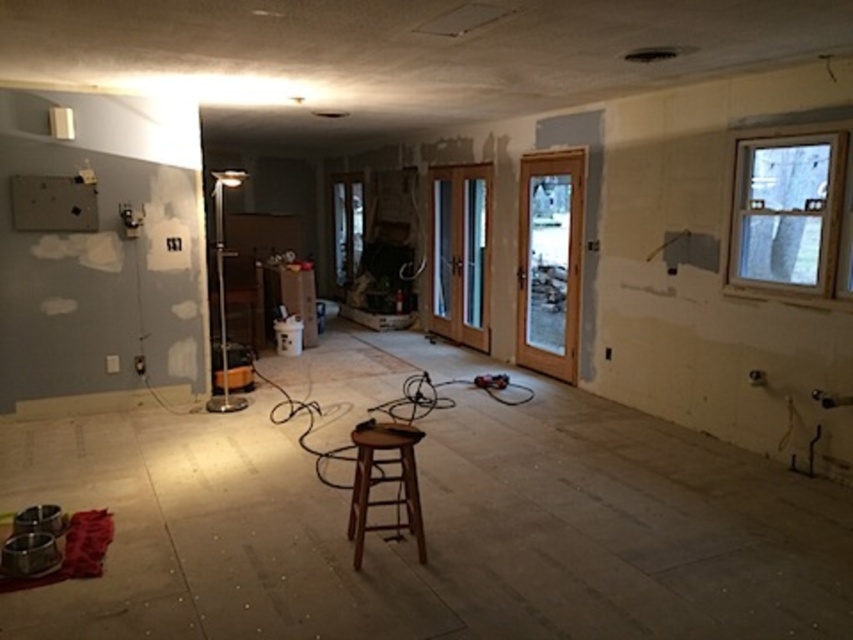
Does point (804, 140) lie behind point (378, 424)?

Yes.

Does clear glass window at upper right have a smaller size compared to brown wooden stool at center?

Yes, clear glass window at upper right is smaller than brown wooden stool at center.

Which is behind, point (808, 192) or point (370, 472)?

The point (808, 192) is behind.

Image resolution: width=853 pixels, height=640 pixels. In order to click on clear glass window at upper right in this screenshot , I will do `click(787, 212)`.